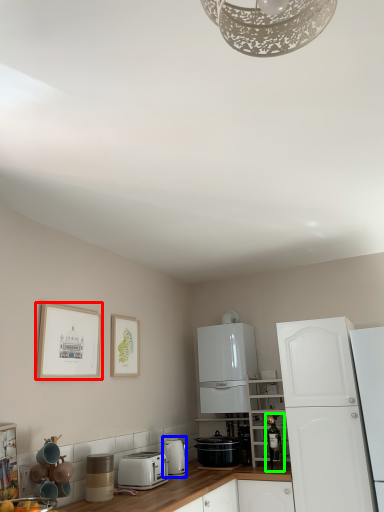
Question: Which is farther away from picture frame (highlighted by a red box)? kitchen appliance (highlighted by a blue box) or appliance (highlighted by a green box)?

Choices:
 (A) kitchen appliance
 (B) appliance

Answer: (B)